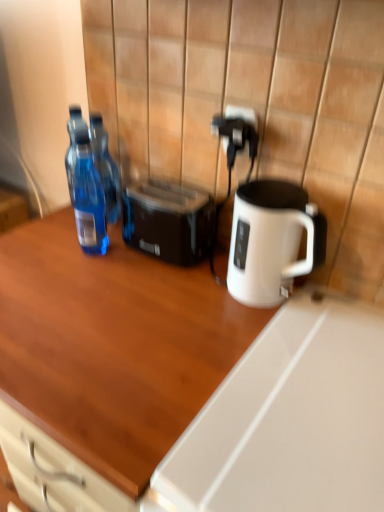
I want to click on free spot in front of black plastic toaster at center, so click(163, 287).